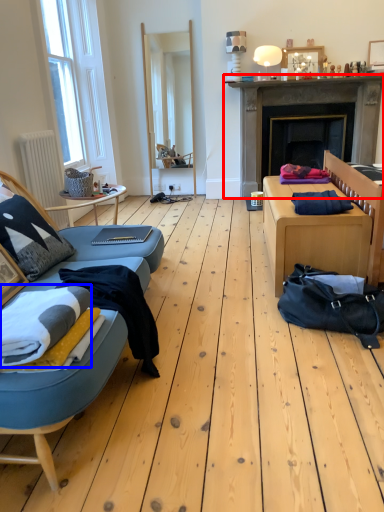
Question: Which object is further to the camera taking this photo, fireplace (highlighted by a red box) or blanket (highlighted by a blue box)?

Choices:
 (A) fireplace
 (B) blanket

Answer: (A)